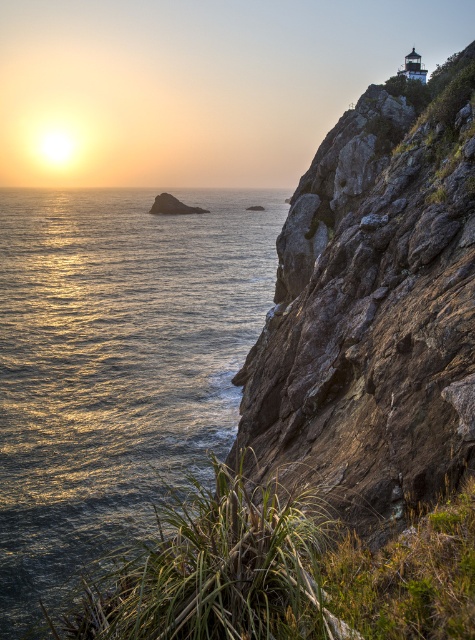
Based on the scene description, where is the shiny metallic water at left located in the image? Please provide its coordinates as a point in the format of a tuple with two decimal numbers between 0 and 1.

The shiny metallic water at left is located at the coordinates point of (115, 364).

In the scene shown: You are a photographer trying to capture the sunset. You have a camera with a wide angle lens that can capture a 120 degree field of view. You are standing at the point marked as point (115, 364). The lighthouse is located on the cliff at the right side of the image. Can you see the lighthouse in your current position?

The point (115, 364) is on shiny metallic water at left, so you are standing on the water. The lighthouse is on the cliff at the right side of the image. Since the cliff is on the right and you are on the left side of the image, you might not be able to see the lighthouse from your current position unless you move closer to the cliff. However, since you are on the water, you might have an obstructed view due to the curvature of the earth or the distance between you and the cliff. Without additional info,

You are a photographer trying to capture the sunset. You notice the shiny metallic water at left and the rusty stone cliff at upper right in your frame. Which object appears taller in the image?

The shiny metallic water at left appears taller than the rusty stone cliff at upper right in the image.